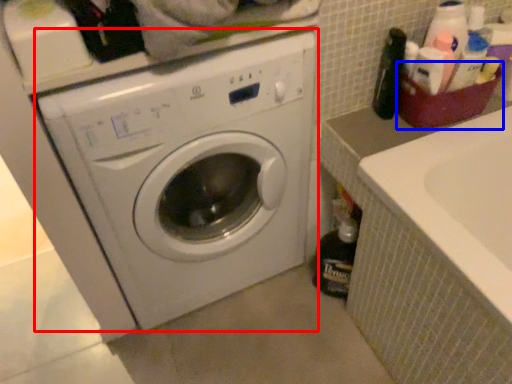
Question: Which of the following is the farthest to the observer, washing machine (highlighted by a red box) or basket (highlighted by a blue box)?

Choices:
 (A) washing machine
 (B) basket

Answer: (B)